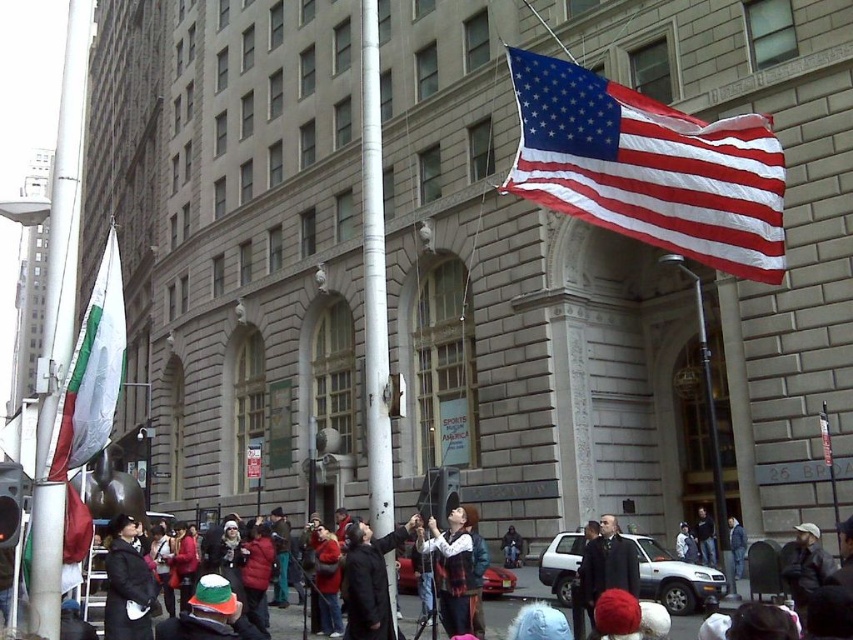
Is point (521, 141) less distant than point (688, 541)?

Yes.

Can you confirm if american flag at upper right is positioned to the right of white cotton jacket at center?

In fact, american flag at upper right is to the left of white cotton jacket at center.

Where is `american flag at upper right`? This screenshot has width=853, height=640. american flag at upper right is located at coordinates (648, 168).

Image resolution: width=853 pixels, height=640 pixels. Identify the location of american flag at upper right. (648, 168).

Can you confirm if dark gray wool coat at lower center is thinner than white cotton jacket at center?

Indeed, dark gray wool coat at lower center has a lesser width compared to white cotton jacket at center.

Is point (608, 566) positioned behind point (688, 548)?

No.

What do you see at coordinates (607, 564) in the screenshot?
I see `dark gray wool coat at lower center` at bounding box center [607, 564].

You are a GUI agent. You are given a task and a screenshot of the screen. Output one action in this format:
    pyautogui.click(x=<x>, y=<y>)
    Task: Click on the dark gray wool coat at lower center
    The image size is (853, 640).
    Given the screenshot: What is the action you would take?
    pyautogui.click(x=607, y=564)

Measure the distance from american flag at upper right to denim jacket at lower right.

The distance of american flag at upper right from denim jacket at lower right is 22.95 meters.

Does american flag at upper right have a greater height compared to denim jacket at lower right?

Yes, american flag at upper right is taller than denim jacket at lower right.

Is point (708, 196) farther from viewer compared to point (743, 531)?

No, (708, 196) is closer to viewer.

This screenshot has width=853, height=640. In order to click on american flag at upper right in this screenshot , I will do `click(648, 168)`.